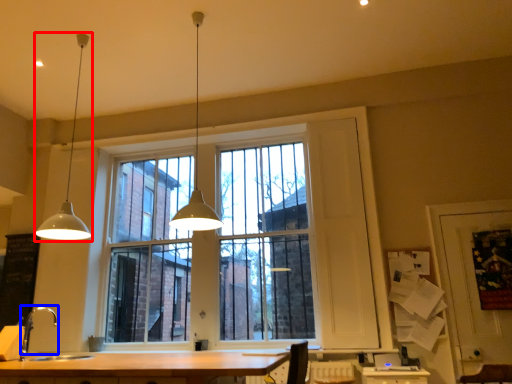
Question: Which point is further to the camera, lamp (highlighted by a red box) or faucet (highlighted by a blue box)?

Choices:
 (A) lamp
 (B) faucet

Answer: (A)